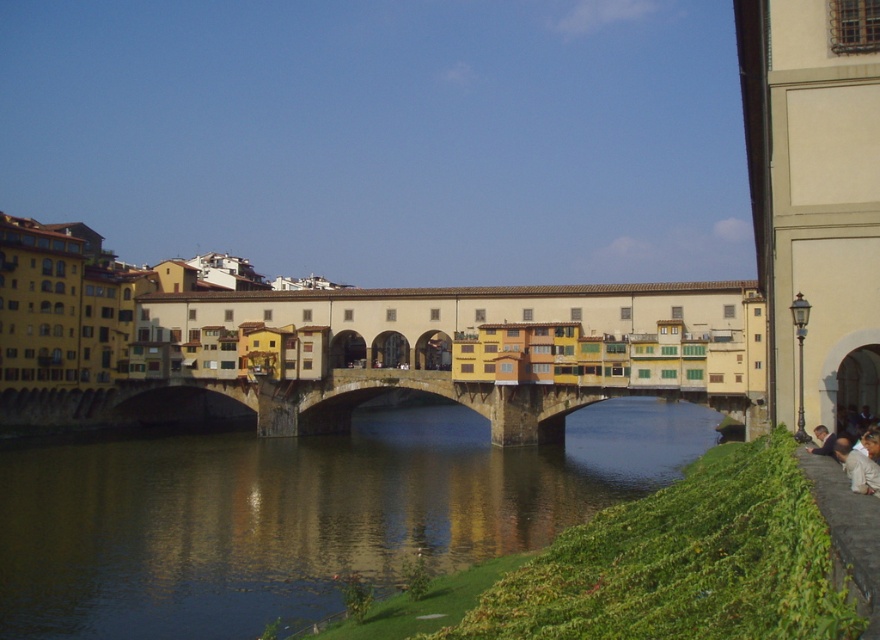
Question: Is green grassy bank at lower right smaller than white fabric at lower right?

Choices:
 (A) yes
 (B) no

Answer: (B)

Question: Among these objects, which one is farthest from the camera?

Choices:
 (A) white fabric at lower right
 (B) stone bridge at center

Answer: (B)

Question: Does green grassy bank at lower right have a smaller size compared to light brown leather jacket at lower right?

Choices:
 (A) yes
 (B) no

Answer: (B)

Question: Estimate the real-world distances between objects in this image. Which object is farther from the stone bridge at center?

Choices:
 (A) white fabric at lower right
 (B) light brown leather jacket at lower right
 (C) green grassy bank at lower right

Answer: (B)

Question: Where is stone bridge at center located in relation to white fabric at lower right in the image?

Choices:
 (A) left
 (B) right

Answer: (A)

Question: Which object is the closest to the stone bridge at center?

Choices:
 (A) light brown leather jacket at lower right
 (B) green grassy bank at lower right

Answer: (B)